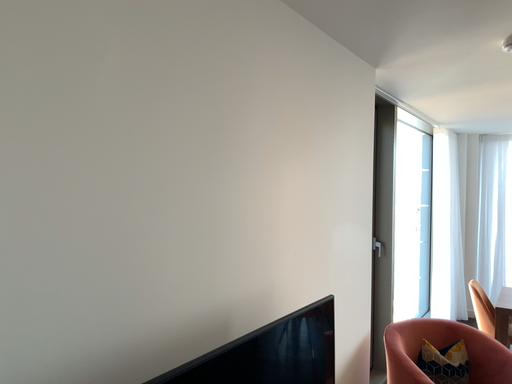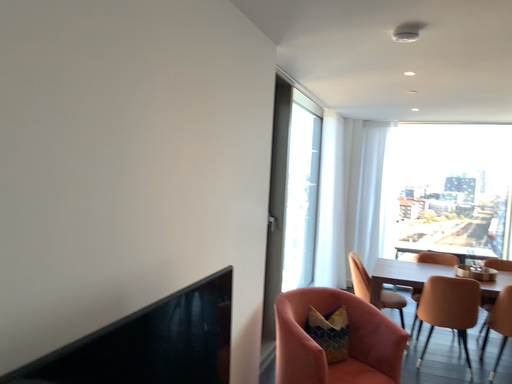
Question: How did the camera likely rotate when shooting the video?

Choices:
 (A) rotated right
 (B) rotated left

Answer: (A)